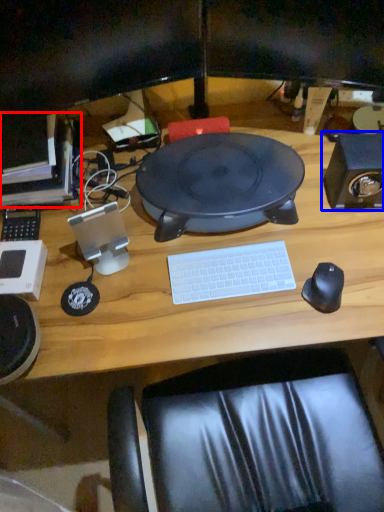
Question: Which object is closer to the camera taking this photo, computer (highlighted by a red box) or speaker (highlighted by a blue box)?

Choices:
 (A) computer
 (B) speaker

Answer: (B)